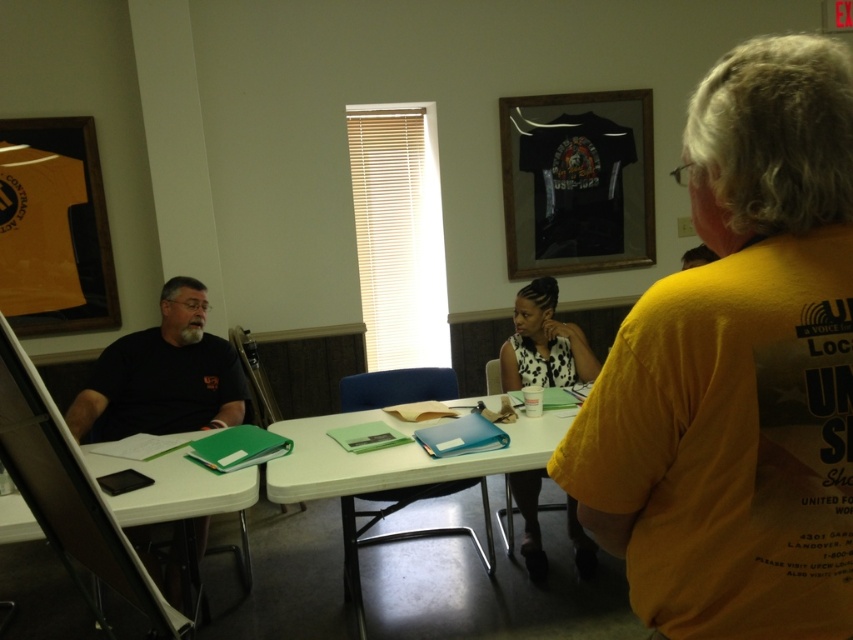
Does yellow t-shirt at right have a greater height compared to white plastic table at center?

No.

What do you see at coordinates (738, 371) in the screenshot?
I see `yellow t-shirt at right` at bounding box center [738, 371].

Is point (622, 476) farther from viewer compared to point (517, 436)?

No.

The height and width of the screenshot is (640, 853). I want to click on yellow t-shirt at right, so (x=738, y=371).

Does black matte shirt at left have a greater width compared to white plastic table at center?

In fact, black matte shirt at left might be narrower than white plastic table at center.

Measure the distance between black matte shirt at left and camera.

They are 8.35 feet apart.

This screenshot has height=640, width=853. What are the coordinates of `black matte shirt at left` in the screenshot? It's located at (163, 376).

Does white dotted dress at center appear on the right side of green plastic folder at lower left?

Yes, white dotted dress at center is to the right of green plastic folder at lower left.

Find the location of a particular element. Image resolution: width=853 pixels, height=640 pixels. white dotted dress at center is located at coordinates (543, 342).